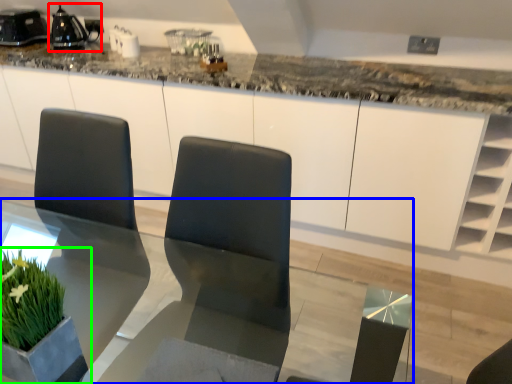
Question: Considering the real-world distances, which object is farthest from appliance (highlighted by a red box)? table (highlighted by a blue box) or houseplant (highlighted by a green box)?

Choices:
 (A) table
 (B) houseplant

Answer: (B)